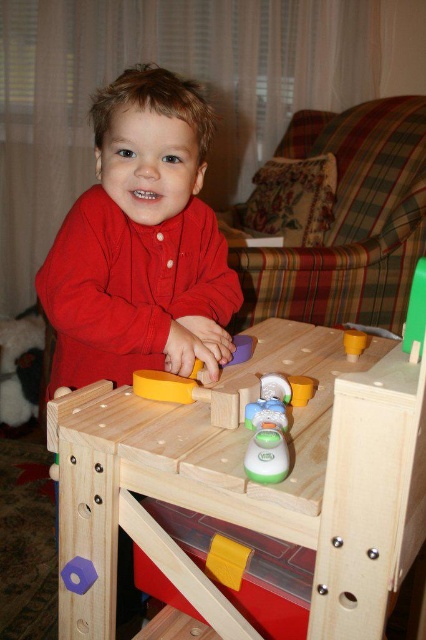
Is matte red shirt at center to the right of yellow matte hammer at center from the viewer's perspective?

In fact, matte red shirt at center is to the left of yellow matte hammer at center.

Does matte red shirt at center have a greater width compared to yellow matte hammer at center?

Indeed, matte red shirt at center has a greater width compared to yellow matte hammer at center.

Locate an element on the screen. matte red shirt at center is located at coordinates (141, 243).

Is point (172, 541) positioned before point (172, 241)?

Yes.

Does natural wood workbench at center have a lesser width compared to matte red shirt at center?

No, natural wood workbench at center is not thinner than matte red shirt at center.

This screenshot has height=640, width=426. I want to click on natural wood workbench at center, so click(252, 483).

Identify the location of natural wood workbench at center. The height and width of the screenshot is (640, 426). (252, 483).

Between natural wood workbench at center and yellow matte hammer at center, which one is positioned lower?

Positioned lower is natural wood workbench at center.

Is natural wood workbench at center closer to camera compared to yellow matte hammer at center?

Yes.

At what (x,y) coordinates should I click in order to perform the action: click on natural wood workbench at center. Please return your answer as a coordinate pair (x, y). Looking at the image, I should click on (252, 483).

The width and height of the screenshot is (426, 640). I want to click on natural wood workbench at center, so click(252, 483).